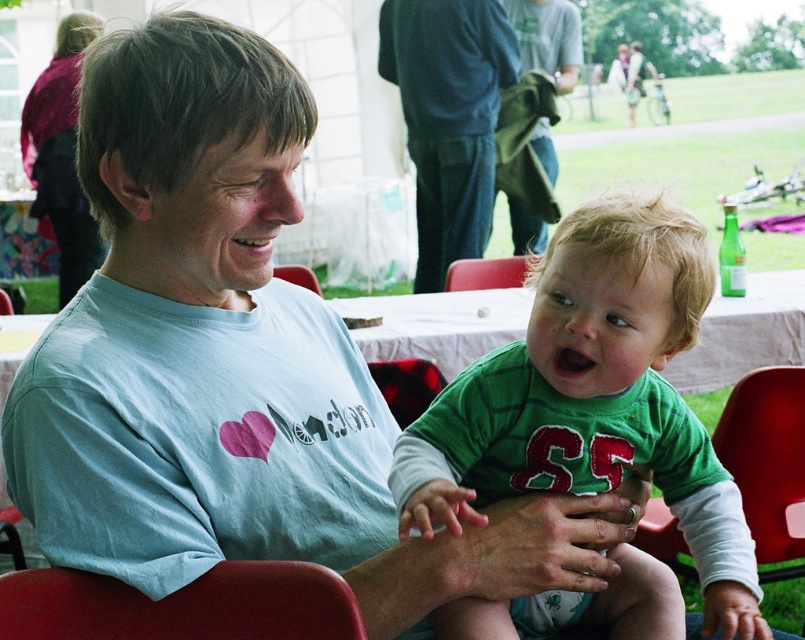
Who is higher up, green soft cotton shirt at center or green cotton shirt at upper center?

green cotton shirt at upper center

Who is positioned more to the left, green soft cotton shirt at center or green cotton shirt at upper center?

green soft cotton shirt at center is more to the left.

Who is more forward, (548, 272) or (517, 232)?

Point (548, 272) is in front.

Find the location of a particular element. green soft cotton shirt at center is located at coordinates (592, 397).

Which is above, dark blue jeans at center or red plastic chair at lower left?

dark blue jeans at center is higher up.

Does dark blue jeans at center appear over red plastic chair at lower left?

Yes.

Does point (455, 36) come farther from viewer compared to point (178, 634)?

Yes.

Locate an element on the screen. Image resolution: width=805 pixels, height=640 pixels. dark blue jeans at center is located at coordinates (448, 116).

Measure the distance from red plastic chair at lower left to red plastic chair at center.

They are 3.02 meters apart.

Who is positioned more to the right, red plastic chair at lower left or red plastic chair at center?

Positioned to the right is red plastic chair at center.

The image size is (805, 640). What do you see at coordinates (182, 605) in the screenshot? I see `red plastic chair at lower left` at bounding box center [182, 605].

Where is `red plastic chair at lower left`? This screenshot has height=640, width=805. red plastic chair at lower left is located at coordinates (182, 605).